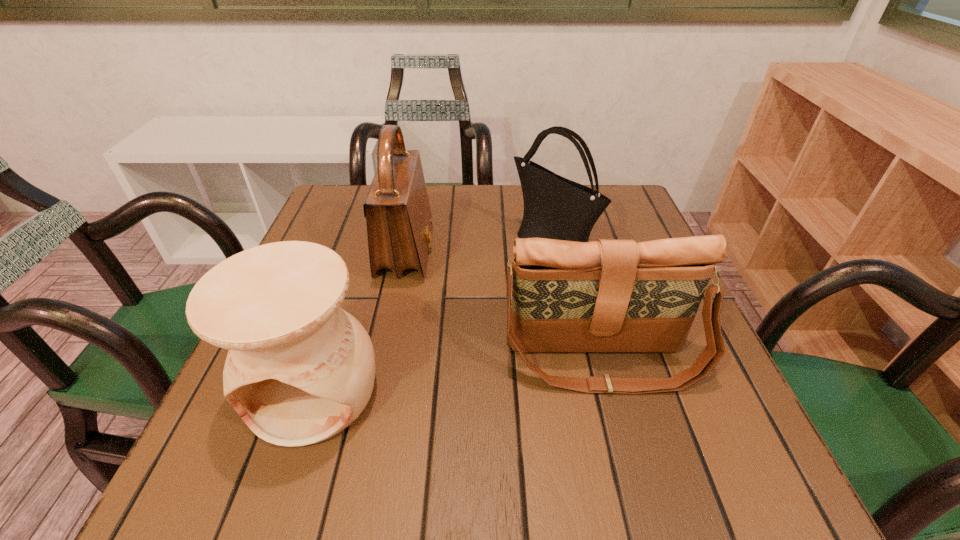
In order to click on the leftmost shoulder bag in this screenshot , I will do [399, 222].

The height and width of the screenshot is (540, 960). I want to click on the shortest shoulder bag, so click(606, 295).

Find the location of a particular element. This screenshot has height=540, width=960. pottery is located at coordinates (300, 369).

Locate an element on the screen. This screenshot has width=960, height=540. free space located on the front flap of the leftmost shoulder bag is located at coordinates (492, 252).

Find the location of a particular element. The image size is (960, 540). free space located 0.110m on the front-facing side of the nearest shoulder bag is located at coordinates (629, 462).

In order to click on object that is at the near edge in this screenshot , I will do (300, 369).

The image size is (960, 540). Find the location of `object located at the left edge`. object located at the left edge is located at coordinates (300, 369).

At what (x,y) coordinates should I click in order to perform the action: click on object that is at the near left corner. Please return your answer as a coordinate pair (x, y). This screenshot has width=960, height=540. Looking at the image, I should click on (300, 369).

At what (x,y) coordinates should I click in order to perform the action: click on object present at the far right corner. Please return your answer as a coordinate pair (x, y). Looking at the image, I should click on (557, 208).

This screenshot has width=960, height=540. I want to click on vacant space at the far edge of the desktop, so click(x=495, y=222).